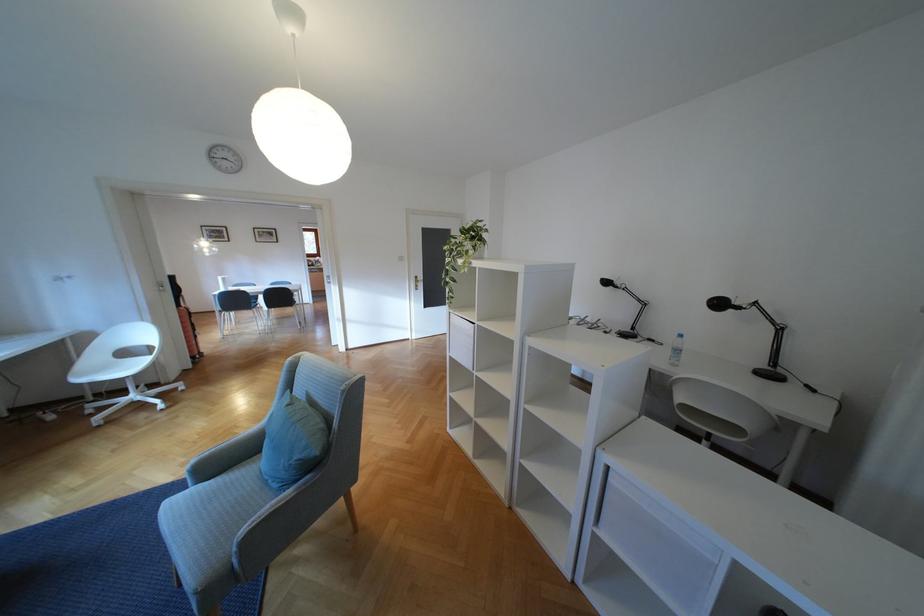
Find where to pull the silver door handle. Please return your answer as a coordinate pair (x, y).

(417, 281)